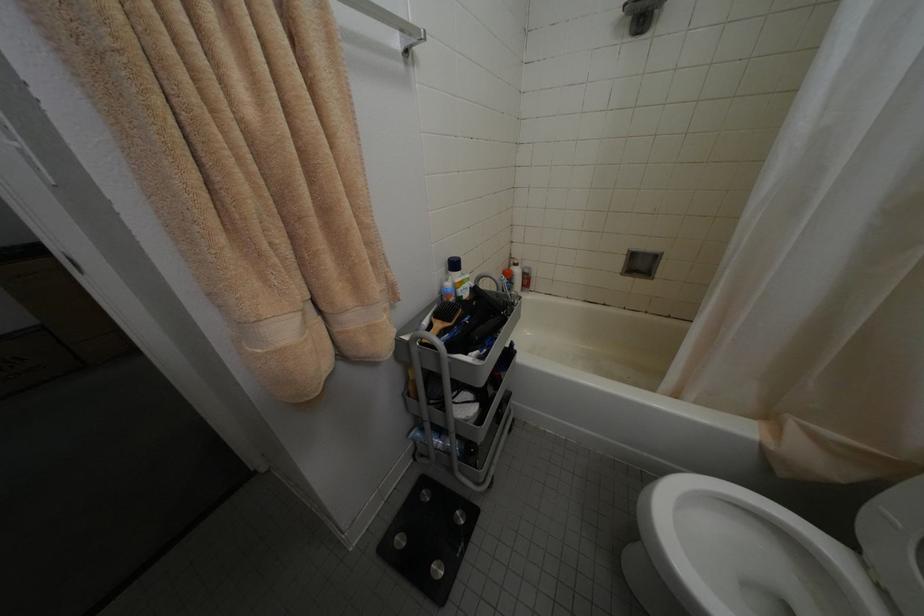
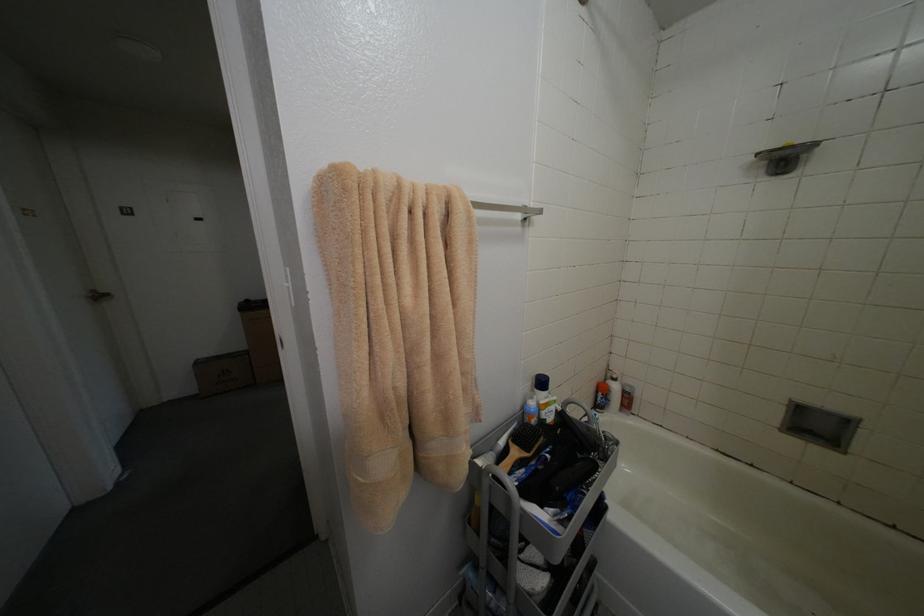
Question: The camera is either moving clockwise (left) or counter-clockwise (right) around the object. The first image is from the beginning of the video and the second image is from the end. Is the camera moving left or right when shooting the video?

Choices:
 (A) Left
 (B) Right

Answer: (B)